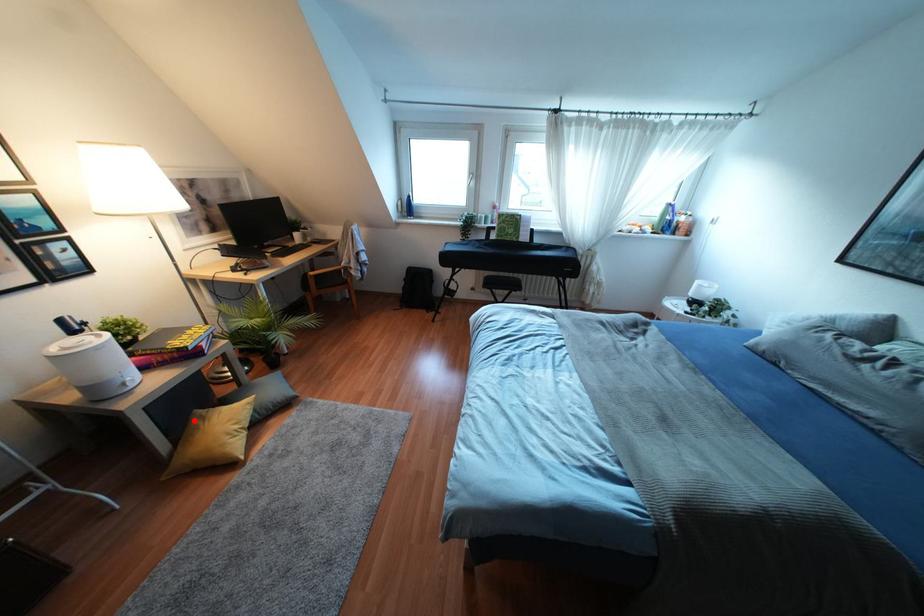
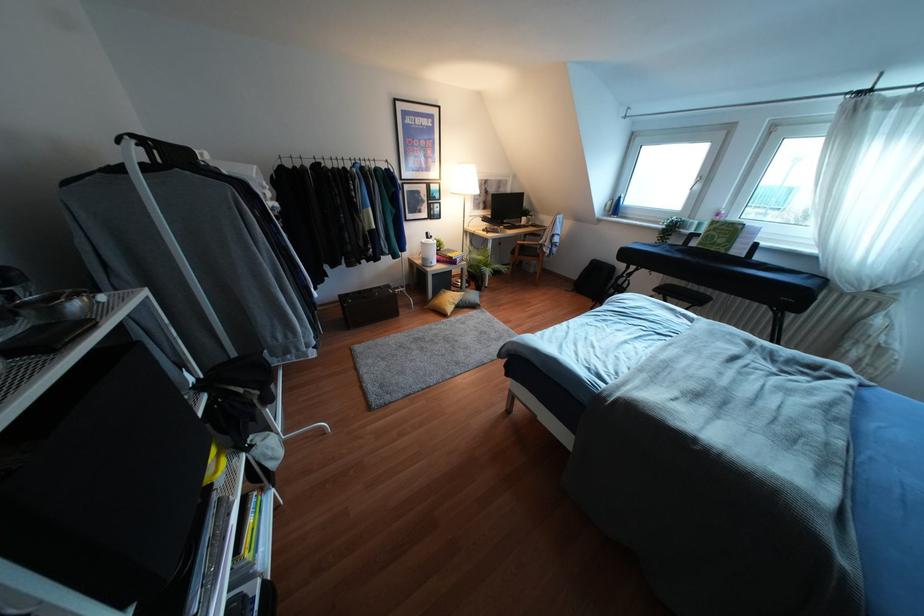
Question: I am providing you with two images of the same scene from different viewpoints. In image1, a red point is highlighted. Considering the same 3D point in image2, which of the following is correct?

Choices:
 (A) It is closer
 (B) It is farther

Answer: (A)